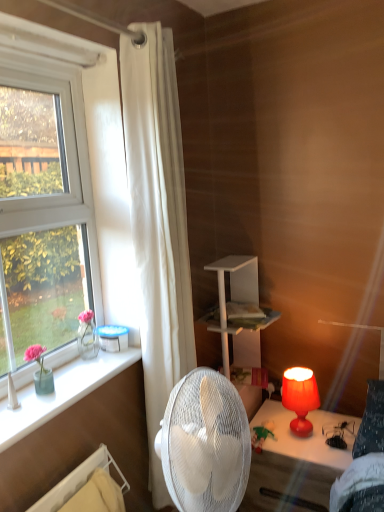
Locate an element on the screen. The image size is (384, 512). blank space situated above clear glass vase at left (from a real-world perspective) is located at coordinates [74, 375].